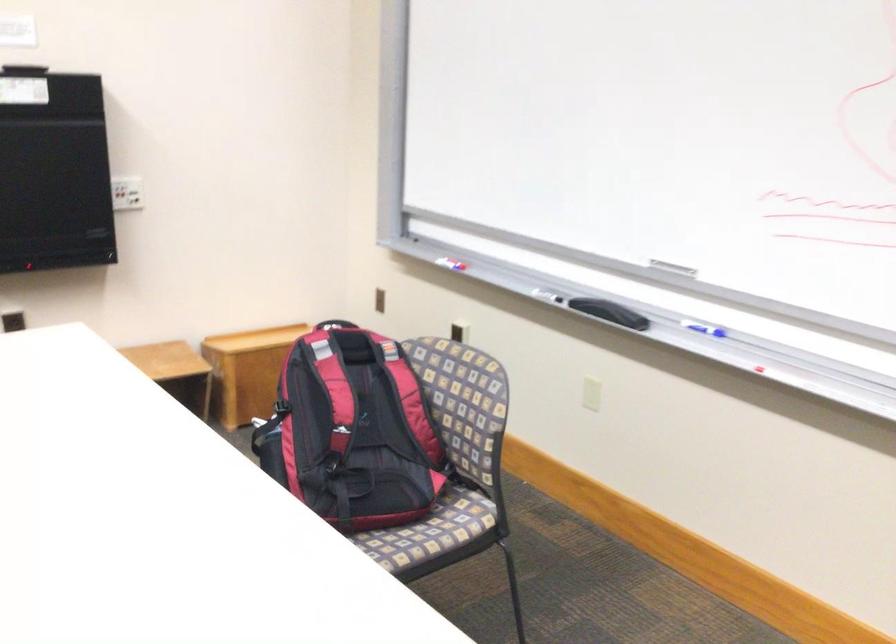
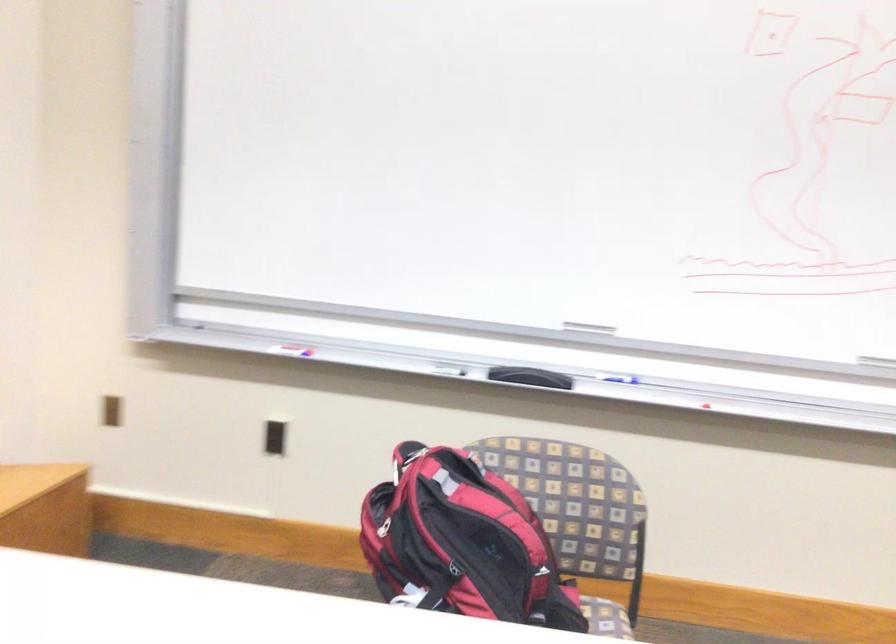
In the second image, find the point that corresponds to (x=452, y=332) in the first image.

(273, 438)